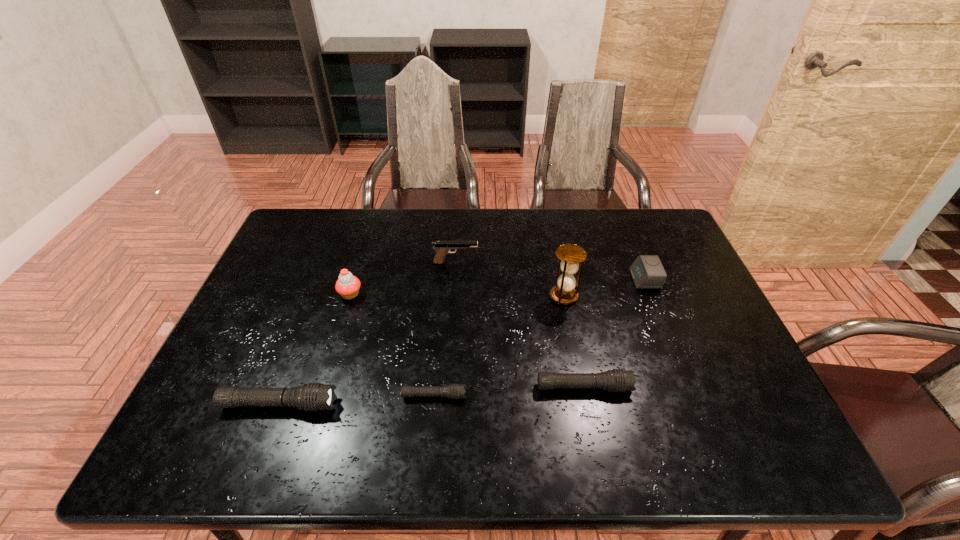
The flashlights are evenly distributed in the image. To maintain this, where would you place another flashlight on the right? Please point to a free space. Please provide its 2D coordinates. Your answer should be formatted as a tuple, i.e. [(x, y)], where the tuple contains the x and y coordinates of a point satisfying the conditions above.

[(729, 379)]